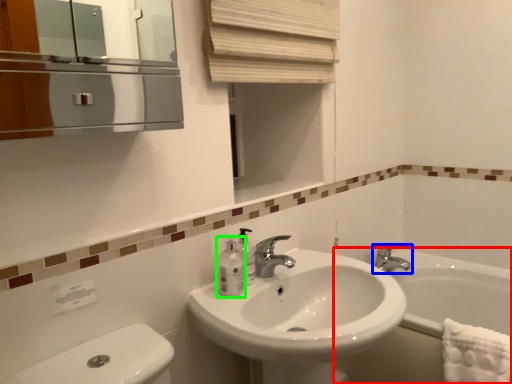
Question: Estimate the real-world distances between objects in this image. Which object is closer to bath (highlighted by a red box), tap (highlighted by a blue box) or mouthwash (highlighted by a green box)?

Choices:
 (A) tap
 (B) mouthwash

Answer: (A)